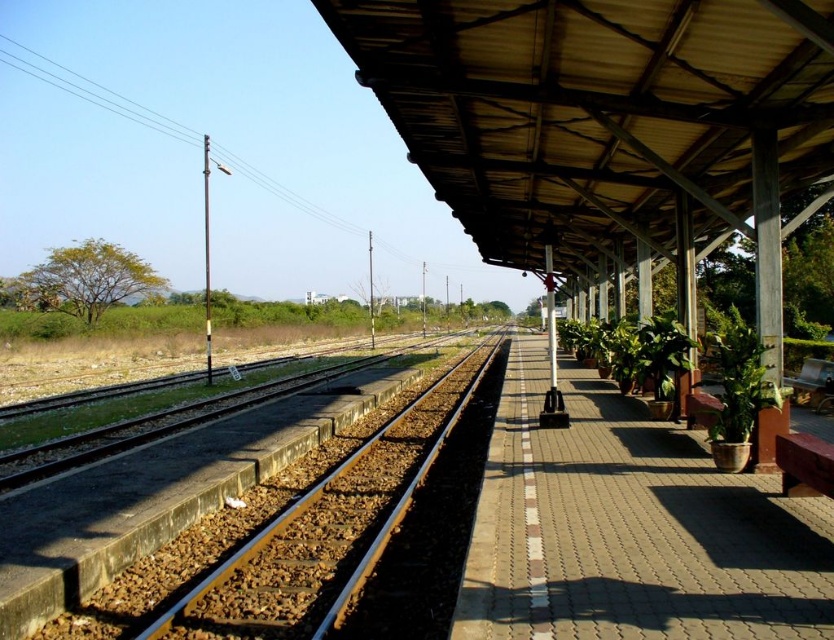
Between point (682, 493) and point (284, 547), which one is positioned in front?

Positioned in front is point (682, 493).

Find the location of `green leafy plants at center`. green leafy plants at center is located at coordinates (631, 529).